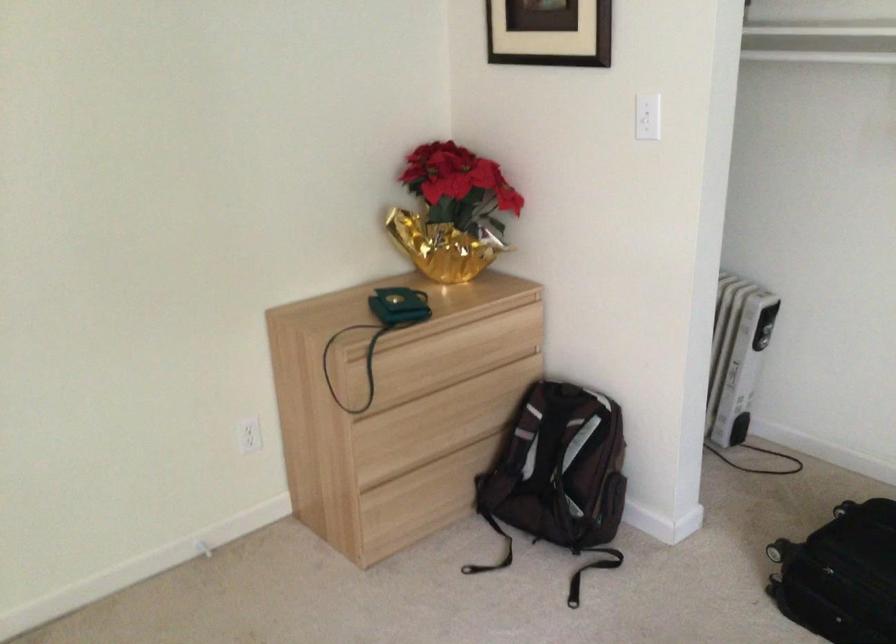
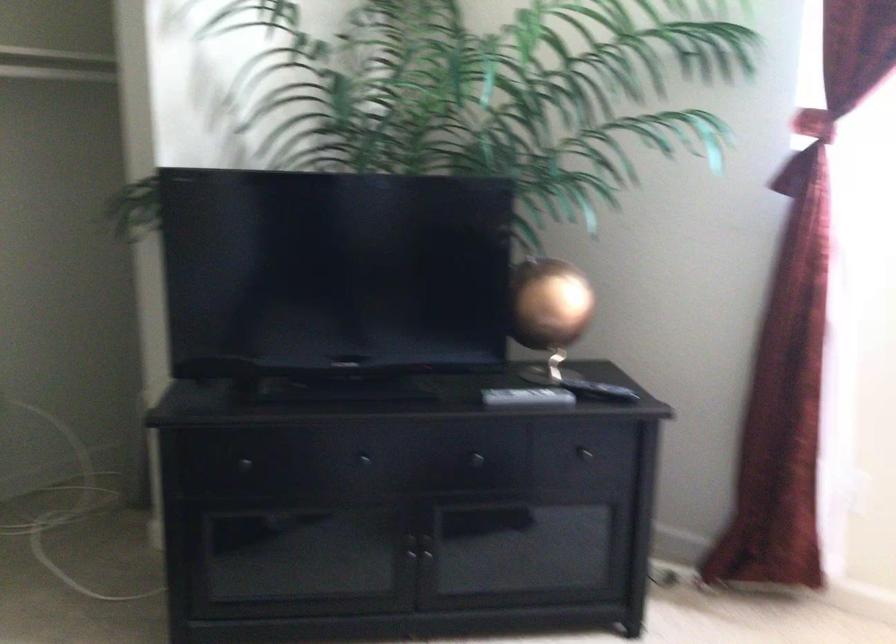
Question: The first image is from the beginning of the video and the second image is from the end. How did the camera likely rotate when shooting the video?

Choices:
 (A) Left
 (B) Right
 (C) Up
 (D) Down

Answer: (B)